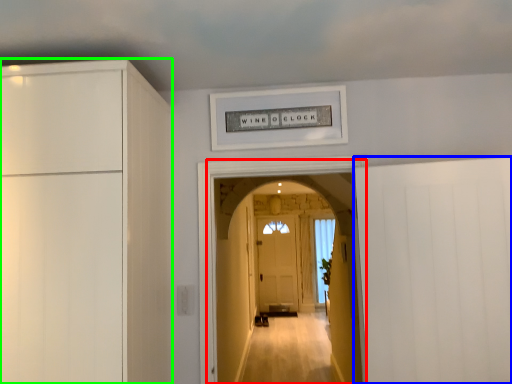
Question: Based on their relative distances, which object is farther from corridor (highlighted by a red box)? Choose from door (highlighted by a blue box) and cabinetry (highlighted by a green box).

Choices:
 (A) door
 (B) cabinetry

Answer: (B)